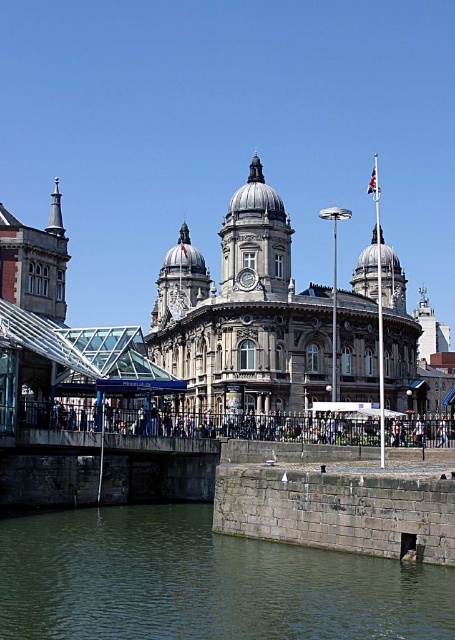
Question: Which object is the closest to the stone clock tower at center?

Choices:
 (A) concrete bridge at center
 (B) greenish stone water at lower left
 (C) polished stone clock tower at center

Answer: (C)

Question: Can you confirm if dark gray stone bridge at center is smaller than polished stone clock tower at center?

Choices:
 (A) yes
 (B) no

Answer: (B)

Question: Does dark gray stone bridge at center appear over polished stone clock tower at center?

Choices:
 (A) yes
 (B) no

Answer: (B)

Question: Which point is farther to the camera?

Choices:
 (A) (158, 573)
 (B) (9, 436)
 (C) (196, 422)

Answer: (C)

Question: From the image, what is the correct spatial relationship of dark gray stone bridge at center in relation to polished stone clock tower at center?

Choices:
 (A) right
 (B) left

Answer: (B)

Question: Which object appears closest to the camera in this image?

Choices:
 (A) polished stone clock tower at center
 (B) greenish stone water at lower left

Answer: (B)